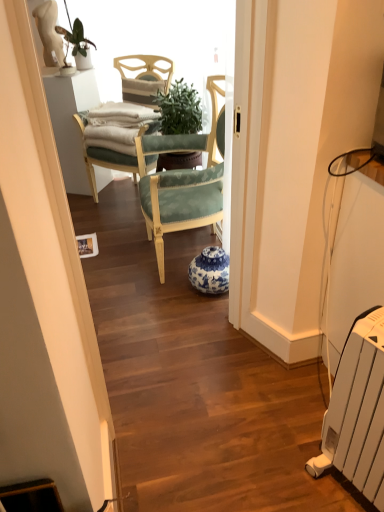
Question: From the image's perspective, is blue and white porcelain vase at center under white plastic radiator at lower right?

Choices:
 (A) yes
 (B) no

Answer: (B)

Question: Does blue and white porcelain vase at center have a lesser width compared to white plastic radiator at lower right?

Choices:
 (A) yes
 (B) no

Answer: (A)

Question: From a real-world perspective, is blue and white porcelain vase at center positioned under white plastic radiator at lower right based on gravity?

Choices:
 (A) no
 (B) yes

Answer: (B)

Question: Is white plastic radiator at lower right located within blue and white porcelain vase at center?

Choices:
 (A) no
 (B) yes

Answer: (A)

Question: Can you confirm if blue and white porcelain vase at center is smaller than white plastic radiator at lower right?

Choices:
 (A) yes
 (B) no

Answer: (A)

Question: Can you confirm if blue and white porcelain vase at center is bigger than white plastic radiator at lower right?

Choices:
 (A) no
 (B) yes

Answer: (A)

Question: Would you say white plastic radiator at lower right is outside blue and white porcelain vase at center?

Choices:
 (A) no
 (B) yes

Answer: (B)

Question: Is white plastic radiator at lower right thinner than blue and white porcelain vase at center?

Choices:
 (A) yes
 (B) no

Answer: (B)

Question: From a real-world perspective, is white plastic radiator at lower right physically below blue and white porcelain vase at center?

Choices:
 (A) no
 (B) yes

Answer: (A)

Question: Would you say white plastic radiator at lower right is a long distance from blue and white porcelain vase at center?

Choices:
 (A) no
 (B) yes

Answer: (B)

Question: From the image's perspective, is white plastic radiator at lower right under blue and white porcelain vase at center?

Choices:
 (A) no
 (B) yes

Answer: (B)

Question: Considering the relative positions of white plastic radiator at lower right and blue and white porcelain vase at center in the image provided, is white plastic radiator at lower right to the right of blue and white porcelain vase at center from the viewer's perspective?

Choices:
 (A) no
 (B) yes

Answer: (B)

Question: Can you confirm if green leafy plant at upper left is bigger than blue and white porcelain vase at center?

Choices:
 (A) no
 (B) yes

Answer: (A)